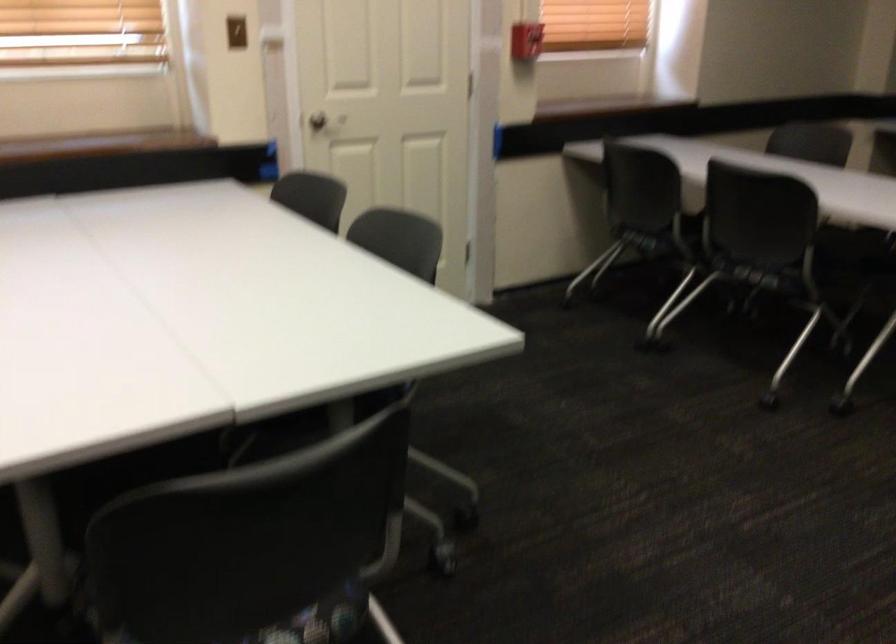
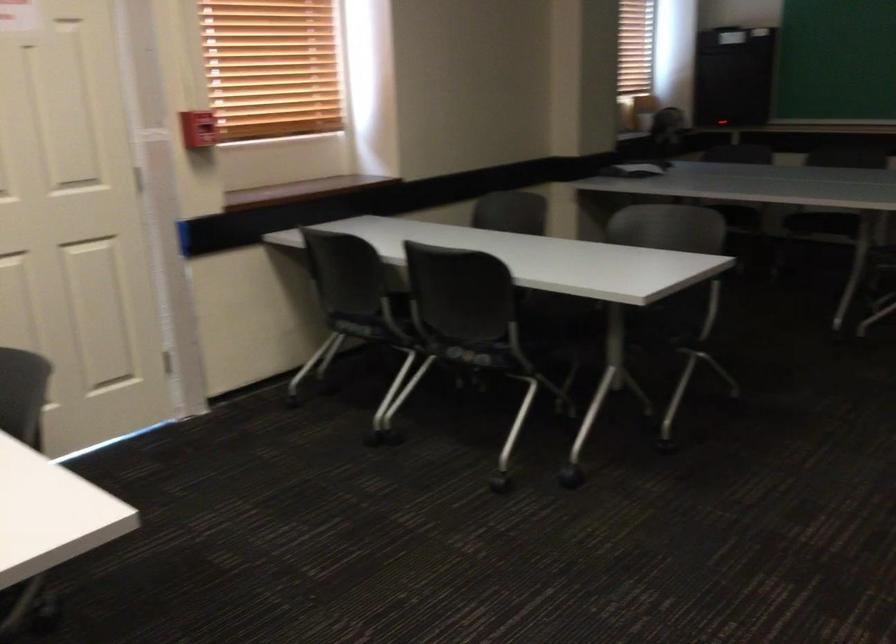
The point at (757, 270) is marked in the first image. Where is the corresponding point in the second image?

(474, 354)